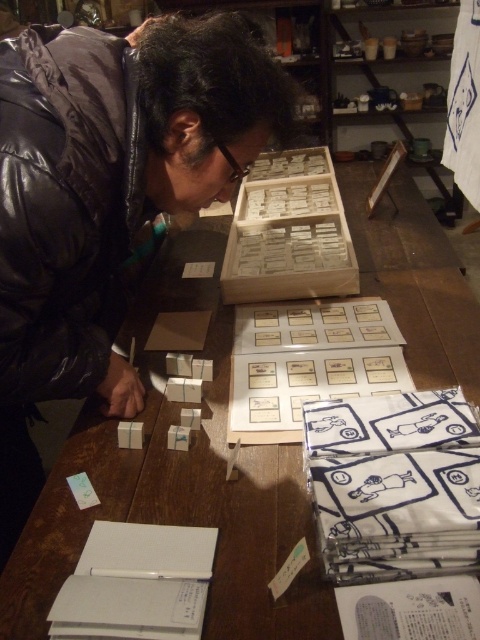
Question: Can you confirm if matte black jacket at center is positioned to the right of wooden box at upper center?

Choices:
 (A) no
 (B) yes

Answer: (A)

Question: Based on their relative distances, which object is nearer to the matte black jacket at center?

Choices:
 (A) wooden box at upper center
 (B) transparent plastic glasses at center

Answer: (B)

Question: Which object is the farthest from the wooden box at upper center?

Choices:
 (A) matte black jacket at center
 (B) transparent plastic glasses at center

Answer: (B)

Question: Is matte black jacket at center positioned behind wooden box at upper center?

Choices:
 (A) no
 (B) yes

Answer: (A)

Question: Can you confirm if matte black jacket at center is positioned above wooden box at upper center?

Choices:
 (A) yes
 (B) no

Answer: (B)

Question: Which of the following is the closest to the observer?

Choices:
 (A) (64, 81)
 (B) (224, 154)
 (C) (263, 204)

Answer: (A)